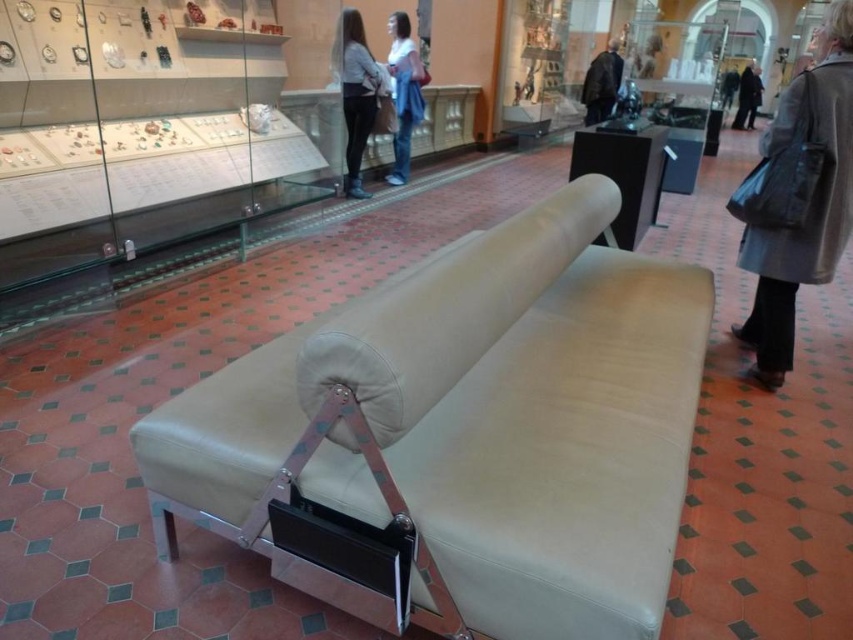
You are standing at the entrance of the museum and want to find the beige leather couch at center. According to the coordinates provided, which direction should you move to reach it?

The beige leather couch at center is located at coordinates point (462, 435). Since the x coordinate is greater than 0.5, you should move to the right to reach it.

You are a visitor at the museum and want to take a photo of the white cotton shirt at upper center without the beige leather couch at center blocking the view. Is the couch shorter than the shirt so it won t block the view?

The beige leather couch at center is not as tall as the white cotton shirt at upper center, so the couch is shorter than the shirt. Therefore, the beige leather couch at center won t block the view of the white cotton shirt at upper center.

You are an interior designer assessing the layout of the room. You notice the matte black speaker at upper center and the white cotton shirt at upper center. Which object is taller in the image?

The white cotton shirt at upper center is taller than the matte black speaker at upper center according to the description.